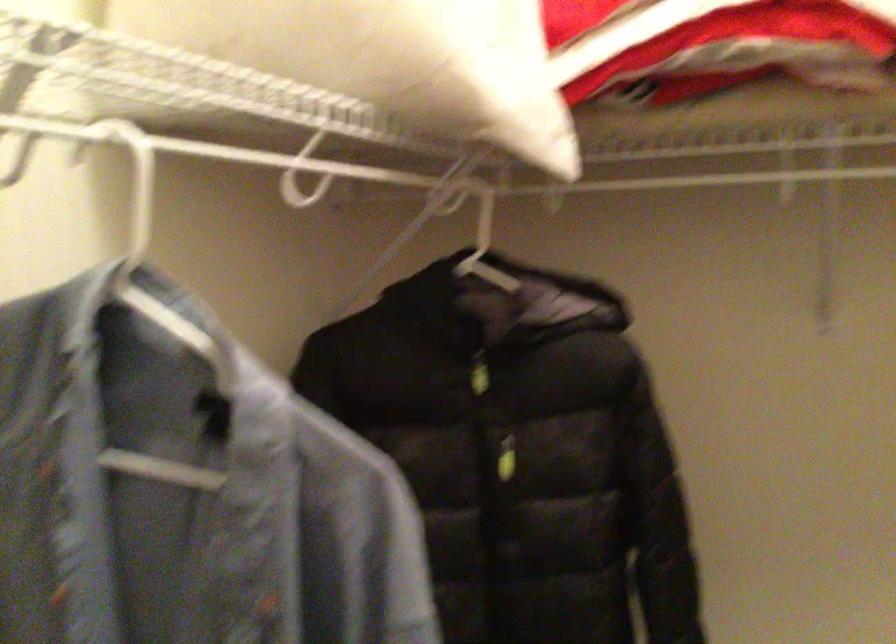
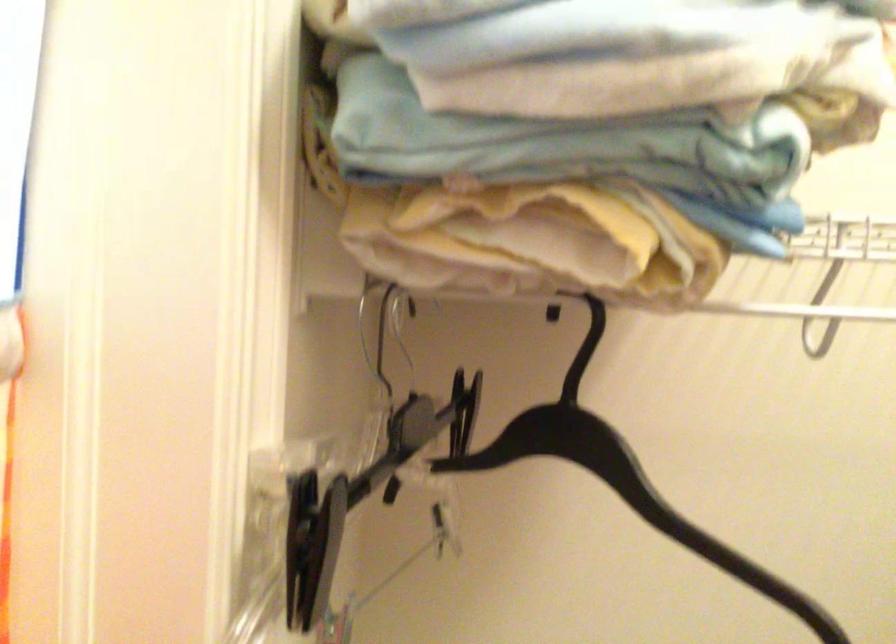
Question: How did the camera likely rotate?

Choices:
 (A) Left
 (B) Right
 (C) Up
 (D) Down

Answer: (A)